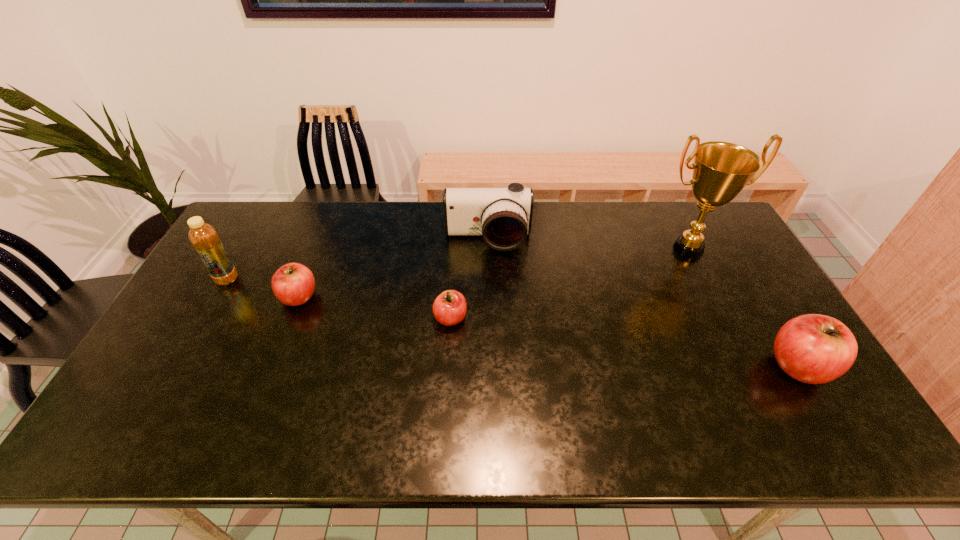
Image resolution: width=960 pixels, height=540 pixels. Identify the location of object that stands as the closest to the leftmost object. click(293, 284).

Identify the location of object that stands as the third closest to the tallest apple. This screenshot has height=540, width=960. (449, 308).

I want to click on apple object that ranks as the second closest to the fifth shortest object, so click(x=449, y=308).

Select which apple appears as the third closest to the second tallest object. Please provide its 2D coordinates. Your answer should be formatted as a tuple, i.e. [(x, y)], where the tuple contains the x and y coordinates of a point satisfying the conditions above.

[(815, 349)]

Find the location of a particular element. The image size is (960, 540). free location that satisfies the following two spatial constraints: 1. on the front side of the second shortest object; 2. on the left side of the second apple from right to left is located at coordinates (291, 318).

Locate an element on the screen. Image resolution: width=960 pixels, height=540 pixels. vacant space that satisfies the following two spatial constraints: 1. on the front side of the leftmost object; 2. on the left side of the nearest apple is located at coordinates (178, 366).

Locate an element on the screen. This screenshot has width=960, height=540. vacant position in the image that satisfies the following two spatial constraints: 1. on the surface of the camcorder; 2. on the left side of the rightmost apple is located at coordinates (490, 366).

Where is `blank space that satisfies the following two spatial constraints: 1. on the surface of the nearest apple; 2. on the left side of the camcorder`? This screenshot has width=960, height=540. blank space that satisfies the following two spatial constraints: 1. on the surface of the nearest apple; 2. on the left side of the camcorder is located at coordinates (490, 366).